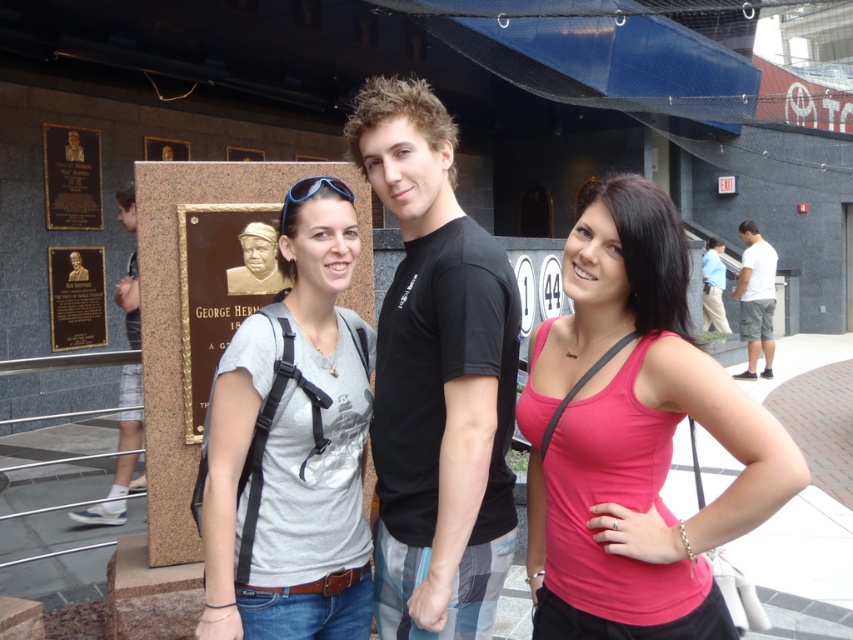
Question: Can you confirm if black cotton t-shirt at center is smaller than white cotton shirt at right?

Choices:
 (A) yes
 (B) no

Answer: (A)

Question: Which of the following is the farthest from the observer?

Choices:
 (A) pink matte tank top at center
 (B) white cotton shirt at right
 (C) matte gray t-shirt at center
 (D) black cotton t-shirt at center

Answer: (B)

Question: Which point is closer to the camera?

Choices:
 (A) (672, 362)
 (B) (247, 240)
 (C) (619, 632)

Answer: (A)

Question: Among these points, which one is farthest from the camera?

Choices:
 (A) (740, 332)
 (B) (281, 288)
 (C) (711, 296)
 (D) (129, 384)

Answer: (C)

Question: Is the position of black cotton t-shirt at center less distant than that of gold plated statue at center?

Choices:
 (A) yes
 (B) no

Answer: (A)

Question: Considering the relative positions of black cotton t-shirt at center and blue shirt at right in the image provided, where is black cotton t-shirt at center located with respect to blue shirt at right?

Choices:
 (A) above
 (B) below

Answer: (B)